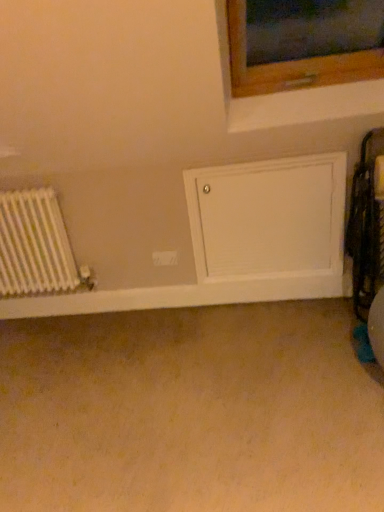
Question: Is point (16, 312) closer or farther from the camera than point (170, 253)?

Choices:
 (A) farther
 (B) closer

Answer: (A)

Question: Considering the positions of white matte door at lower center and white plastic electric outlet at center in the image, is white matte door at lower center bigger or smaller than white plastic electric outlet at center?

Choices:
 (A) big
 (B) small

Answer: (A)

Question: Which is nearer to the white matte door at center?

Choices:
 (A) white metallic radiator at left
 (B) white matte door at lower center
 (C) white plastic electric outlet at center

Answer: (B)

Question: Which is nearer to the white plastic electric outlet at center?

Choices:
 (A) white matte door at center
 (B) white metallic radiator at left
 (C) white matte door at lower center

Answer: (C)